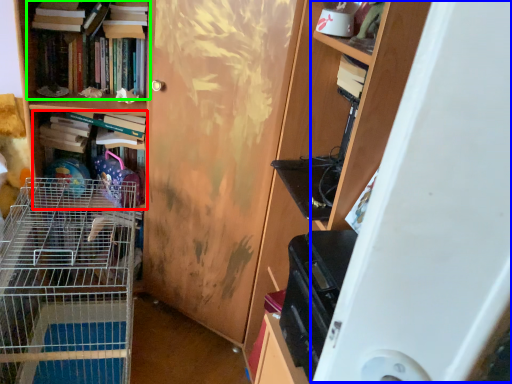
Question: Which object is positioned closest to book (highlighted by a red box)? Select from wide (highlighted by a blue box) and book (highlighted by a green box).

Choices:
 (A) wide
 (B) book

Answer: (B)